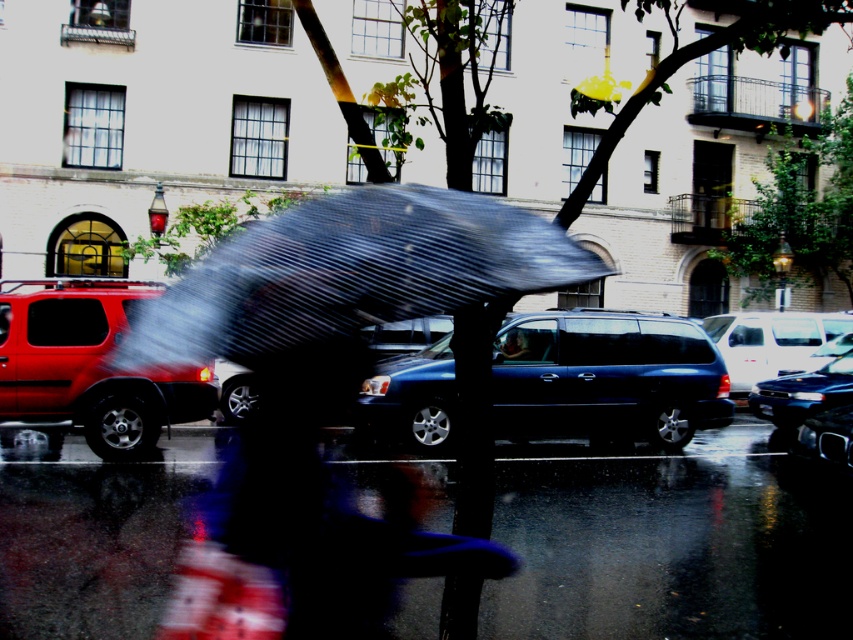
Question: Among these points, which one is farthest from the camera?

Choices:
 (A) (733, 342)
 (B) (761, 392)
 (C) (426, 275)

Answer: (A)

Question: Where is glossy asphalt pavement at lower center located in relation to shiny black sedan at center in the image?

Choices:
 (A) below
 (B) above

Answer: (A)

Question: Does matte red suv at left appear over shiny black sedan at center?

Choices:
 (A) no
 (B) yes

Answer: (B)

Question: Which of the following is the closest to the observer?

Choices:
 (A) (x=169, y=323)
 (B) (x=78, y=388)
 (C) (x=741, y=310)

Answer: (A)

Question: Which point is closer to the camera?

Choices:
 (A) glossy asphalt pavement at lower center
 (B) shiny black sedan at center
 (C) translucent plastic umbrella at center
 (D) shiny dark blue suv at center

Answer: (C)

Question: Is translucent plastic umbrella at center above shiny black sedan at center?

Choices:
 (A) yes
 (B) no

Answer: (A)